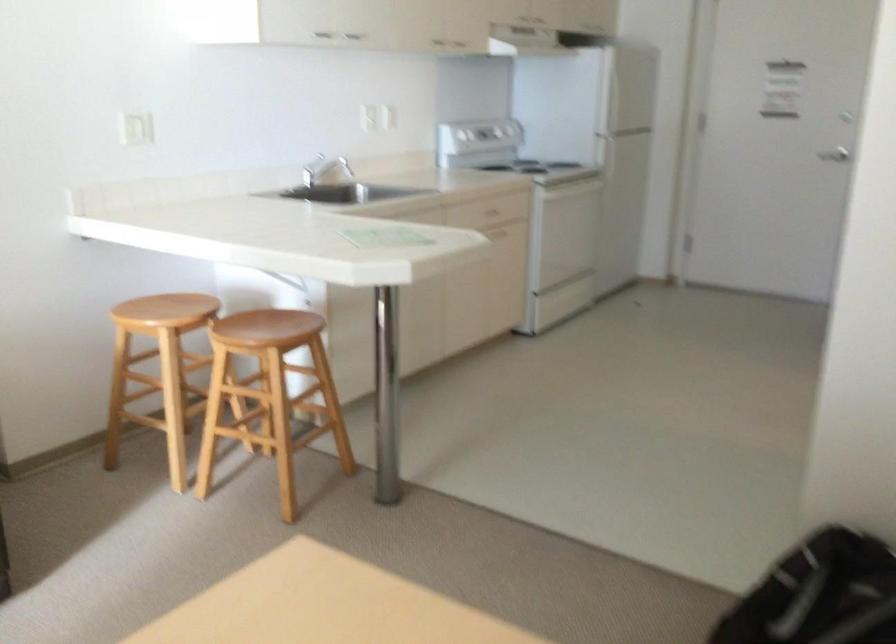
Find where to pull the silver door handle. Please return your answer as a coordinate pair (x, y).

(834, 156)